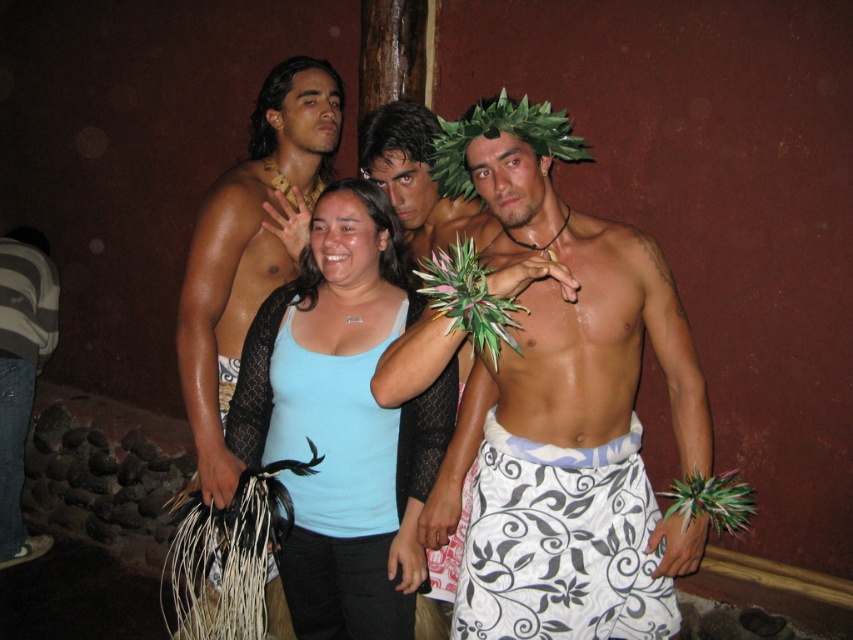
Is point (566, 124) farther from camera compared to point (352, 636)?

No, it is in front of (352, 636).

Measure the distance between white printed sarong at center and light blue fabric shirt at center.

The distance of white printed sarong at center from light blue fabric shirt at center is 11.98 inches.

Between point (505, 396) and point (381, 529), which one is positioned in front?

Point (505, 396) is more forward.

Locate an element on the screen. Image resolution: width=853 pixels, height=640 pixels. white printed sarong at center is located at coordinates (564, 410).

Does light blue fabric shirt at center have a smaller size compared to shiny gold necklace at left?

Yes.

Can you confirm if light blue fabric shirt at center is shorter than shiny gold necklace at left?

Correct, light blue fabric shirt at center is not as tall as shiny gold necklace at left.

Is point (322, 429) closer to camera compared to point (315, 124)?

Yes, it is.

Identify the location of light blue fabric shirt at center. The width and height of the screenshot is (853, 640). (343, 420).

Does white printed sarong at center have a larger size compared to white floral sarong at center?

Indeed, white printed sarong at center has a larger size compared to white floral sarong at center.

Does point (509, 596) come farther from viewer compared to point (396, 168)?

No, it is not.

This screenshot has width=853, height=640. Identify the location of white printed sarong at center. (564, 410).